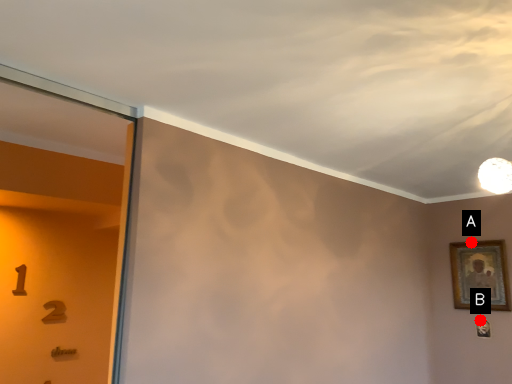
Question: Two points are circled on the image, labeled by A and B beside each circle. Which point appears closest to the camera in this image?

Choices:
 (A) A is closer
 (B) B is closer

Answer: (B)